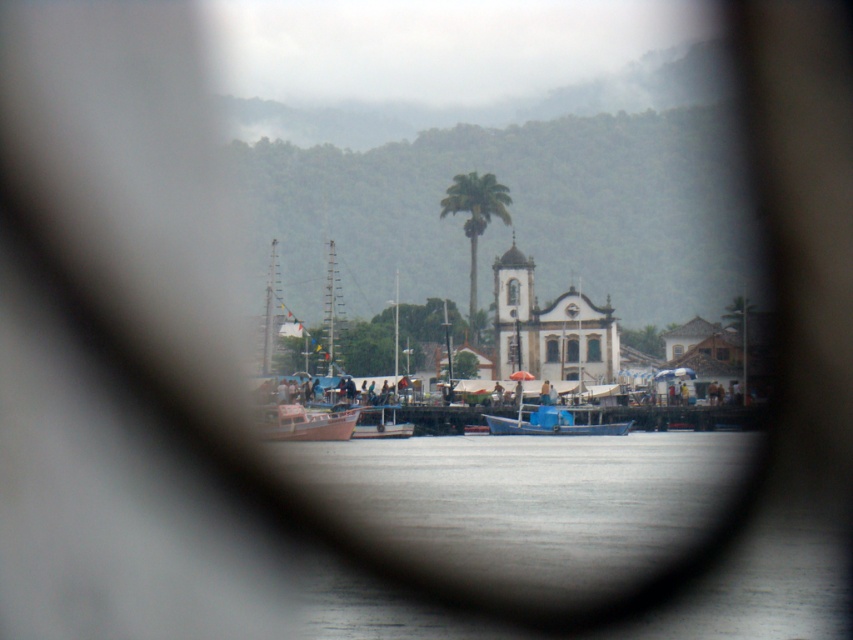
Does blue matte boat at center appear over white matte boat at center?

Yes, blue matte boat at center is above white matte boat at center.

Which is above, blue matte boat at center or white matte boat at center?

blue matte boat at center is above.

Which is behind, point (546, 413) or point (368, 406)?

Positioned behind is point (368, 406).

Locate an element on the screen. blue matte boat at center is located at coordinates (550, 422).

Can you confirm if green leafy palm tree at center is thinner than blue matte boat at center?

Correct, green leafy palm tree at center's width is less than blue matte boat at center's.

From the picture: Is green leafy palm tree at center to the right of blue matte boat at center from the viewer's perspective?

Incorrect, green leafy palm tree at center is not on the right side of blue matte boat at center.

Identify the location of green leafy palm tree at center. (474, 220).

Does green leafy palm tree at center have a greater height compared to wooden boat at center?

Yes.

Can you confirm if green leafy palm tree at center is positioned below wooden boat at center?

No, green leafy palm tree at center is not below wooden boat at center.

Who is more distant from viewer, (477, 179) or (299, 408)?

The point (477, 179) is more distant.

Where is `green leafy palm tree at center`? The width and height of the screenshot is (853, 640). green leafy palm tree at center is located at coordinates (474, 220).